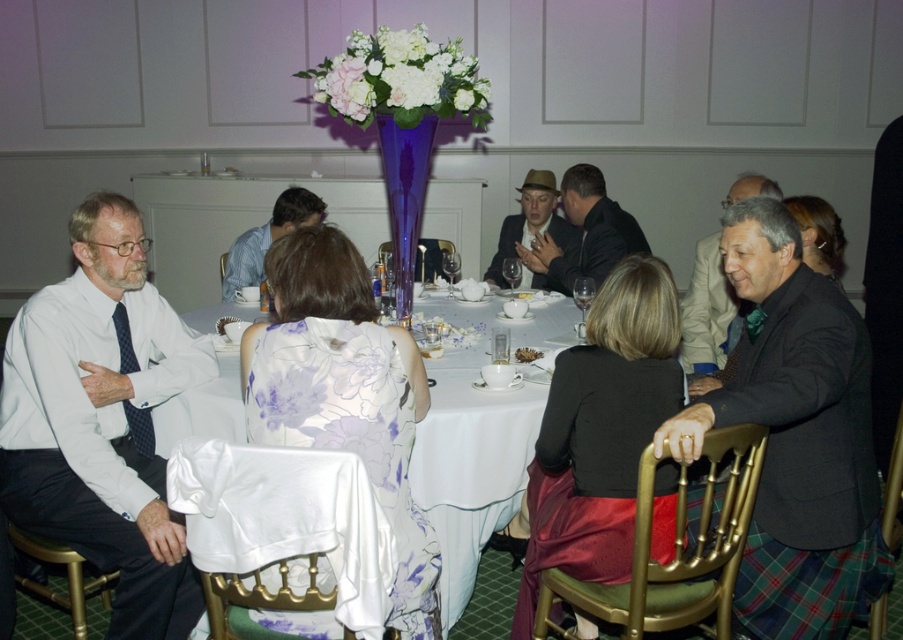
Question: Which of the following is the farthest from the observer?

Choices:
 (A) matte brown hat at center
 (B) white satin tablecloth at center
 (C) blue striped shirt at center

Answer: (A)

Question: Does matte black jacket at center appear over dark gray suit at right?

Choices:
 (A) no
 (B) yes

Answer: (B)

Question: Which point is farther to the camera?

Choices:
 (A) blue striped shirt at center
 (B) white shirt at left
 (C) matte black jacket at center
 (D) white satin tablecloth at center

Answer: (A)

Question: Which of these objects is positioned farthest from the white satin tablecloth at center?

Choices:
 (A) blue striped shirt at center
 (B) dark gray suit at right
 (C) matte brown hat at center

Answer: (A)

Question: Is white satin tablecloth at center to the right of blue striped shirt at center from the viewer's perspective?

Choices:
 (A) yes
 (B) no

Answer: (A)

Question: Is white shirt at left positioned behind matte black jacket at center?

Choices:
 (A) no
 (B) yes

Answer: (A)